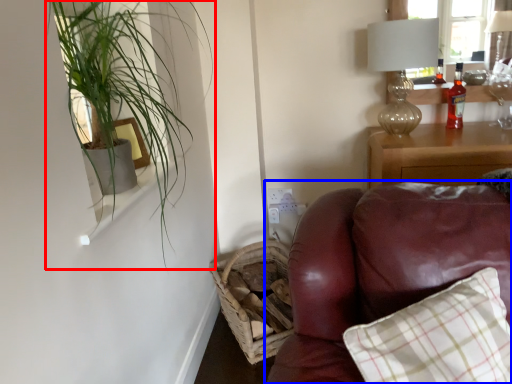
Question: Which of the following is the closest to the observer, houseplant (highlighted by a red box) or studio couch (highlighted by a blue box)?

Choices:
 (A) houseplant
 (B) studio couch

Answer: (B)